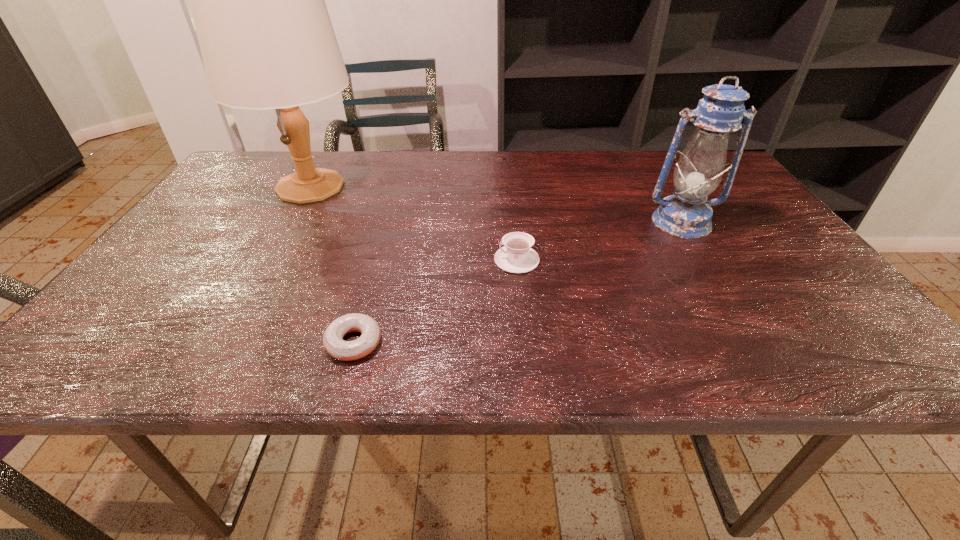
Find the location of a particular element. This screenshot has height=540, width=960. table lamp is located at coordinates (267, 42).

Where is `the tallest object`? The width and height of the screenshot is (960, 540). the tallest object is located at coordinates (267, 42).

Where is `lantern`? lantern is located at coordinates (687, 214).

You are a GUI agent. You are given a task and a screenshot of the screen. Output one action in this format:
    pyautogui.click(x=<x>, y=<y>)
    Task: Click on the rightmost object
    Image resolution: width=960 pixels, height=540 pixels.
    Given the screenshot: What is the action you would take?
    pyautogui.click(x=687, y=214)

I want to click on the third object from left to right, so click(x=516, y=256).

The image size is (960, 540). What are the coordinates of `teacup` in the screenshot? It's located at coord(516,256).

Locate an element on the screen. The height and width of the screenshot is (540, 960). the second object from left to right is located at coordinates (333, 342).

Image resolution: width=960 pixels, height=540 pixels. I want to click on doughnut, so click(333, 342).

Identify the location of vacant space located 0.270m on the front of the tallest object. (251, 290).

This screenshot has height=540, width=960. I want to click on free space located on the front-facing side of the third shortest object, so click(727, 297).